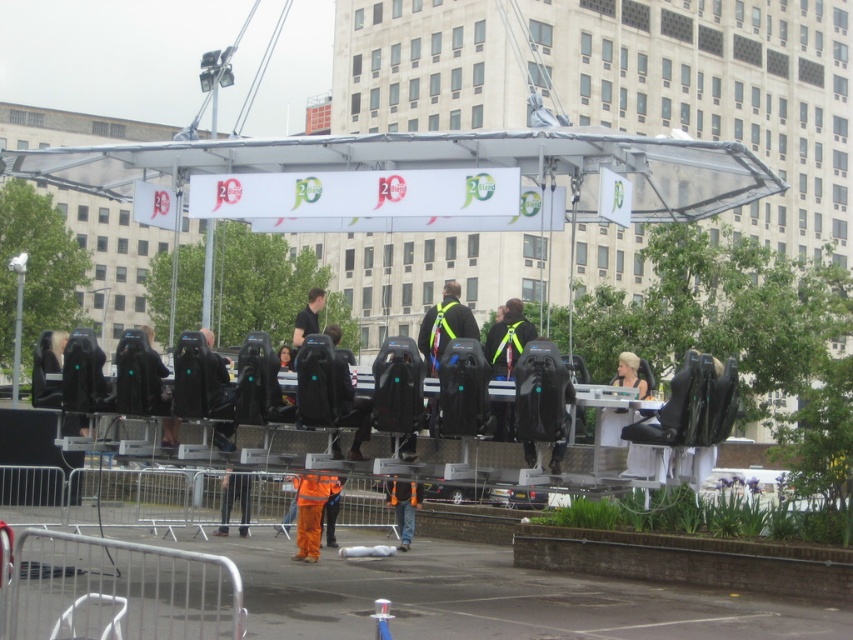
Question: Can you confirm if orange reflective safety vest at center is positioned below black fabric jacket at center?

Choices:
 (A) yes
 (B) no

Answer: (A)

Question: Which point is farther to the camera?

Choices:
 (A) (316, 285)
 (B) (59, 179)
 (C) (309, 547)
 (D) (407, 502)

Answer: (A)

Question: Estimate the real-world distances between objects in this image. Which object is closer to the transparent plastic canopy at upper center?

Choices:
 (A) black fabric jacket at center
 (B) orange reflective overalls at center

Answer: (A)

Question: Which object appears closest to the camera in this image?

Choices:
 (A) black fabric jacket at center
 (B) orange reflective safety vest at center
 (C) orange reflective overalls at center

Answer: (A)

Question: Observing the image, what is the correct spatial positioning of orange reflective overalls at center in reference to black fabric jacket at center?

Choices:
 (A) below
 (B) above

Answer: (A)

Question: Is transparent plastic canopy at upper center to the right of orange reflective overalls at center from the viewer's perspective?

Choices:
 (A) no
 (B) yes

Answer: (B)